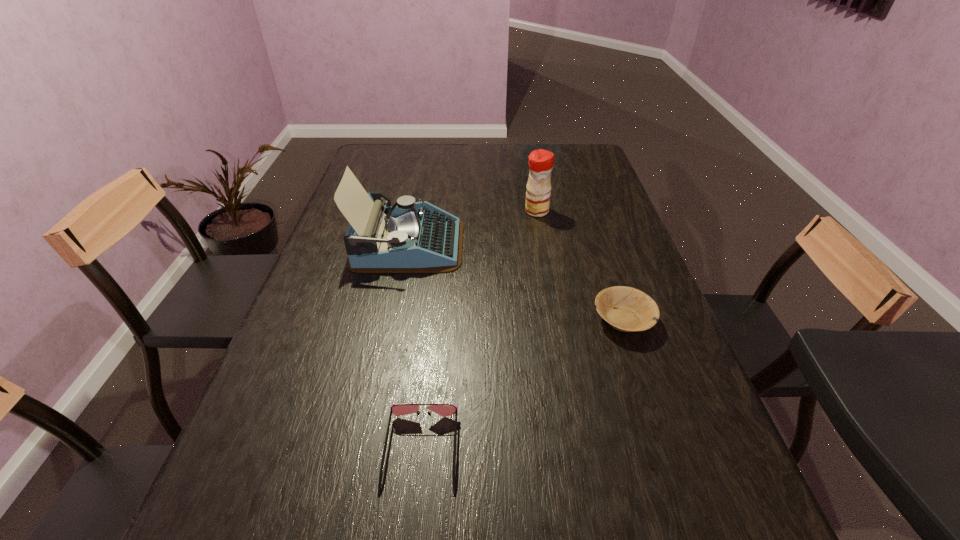
Identify the location of condiment. The width and height of the screenshot is (960, 540). (541, 162).

This screenshot has height=540, width=960. Identify the location of the farthest object. (541, 162).

In order to click on the third nearest object in this screenshot , I will do `click(408, 237)`.

What are the coordinates of `sunglasses` in the screenshot? It's located at (444, 410).

At what (x,y) coordinates should I click in order to perform the action: click on bowl. Please return your answer as a coordinate pair (x, y). This screenshot has height=540, width=960. Looking at the image, I should click on (627, 309).

The image size is (960, 540). Find the location of `the rightmost object`. the rightmost object is located at coordinates (627, 309).

Image resolution: width=960 pixels, height=540 pixels. Find the location of `blank space located on the front of the farthest object`. blank space located on the front of the farthest object is located at coordinates (542, 242).

You are a GUI agent. You are given a task and a screenshot of the screen. Output one action in this format:
    pyautogui.click(x=<x>, y=<y>)
    Task: Click on the blank area located on the typing side of the third nearest object
    The width and height of the screenshot is (960, 540).
    Given the screenshot: What is the action you would take?
    pyautogui.click(x=487, y=244)

Locate an element on the screen. The width and height of the screenshot is (960, 540). vacant area situated 0.050m on the front of the rightmost object is located at coordinates (637, 361).

At what (x,y) coordinates should I click in order to perform the action: click on object present at the left edge. Please return your answer as a coordinate pair (x, y). Looking at the image, I should click on (408, 237).